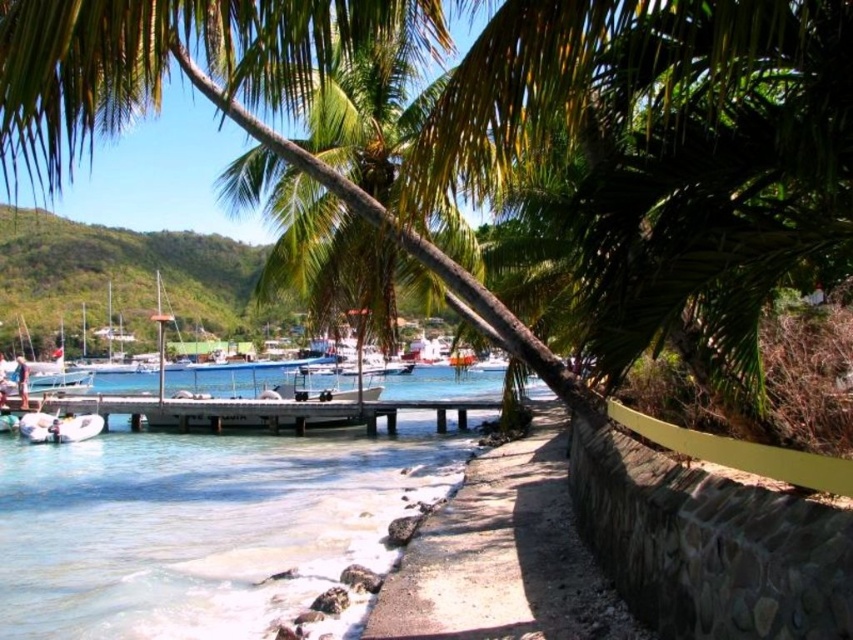
Question: Which point appears closest to the camera in this image?

Choices:
 (A) (102, 420)
 (B) (506, 568)
 (C) (113, 403)

Answer: (B)

Question: Which point appears closest to the camera in this image?

Choices:
 (A) 64,419
 (B) 495,476
 (C) 300,424

Answer: (B)

Question: Considering the relative positions of stone wall at lower right and white rubber boat at lower left in the image provided, where is stone wall at lower right located with respect to white rubber boat at lower left?

Choices:
 (A) above
 (B) below

Answer: (A)

Question: Is wooden pier at center to the left of white rubber boat at lower left from the viewer's perspective?

Choices:
 (A) yes
 (B) no

Answer: (B)

Question: Is stone wall at lower right to the right of white rubber boat at lower left from the viewer's perspective?

Choices:
 (A) yes
 (B) no

Answer: (A)

Question: Which object is closer to the camera taking this photo?

Choices:
 (A) stone wall at lower right
 (B) white rubber boat at lower left
 (C) wooden pier at center

Answer: (A)